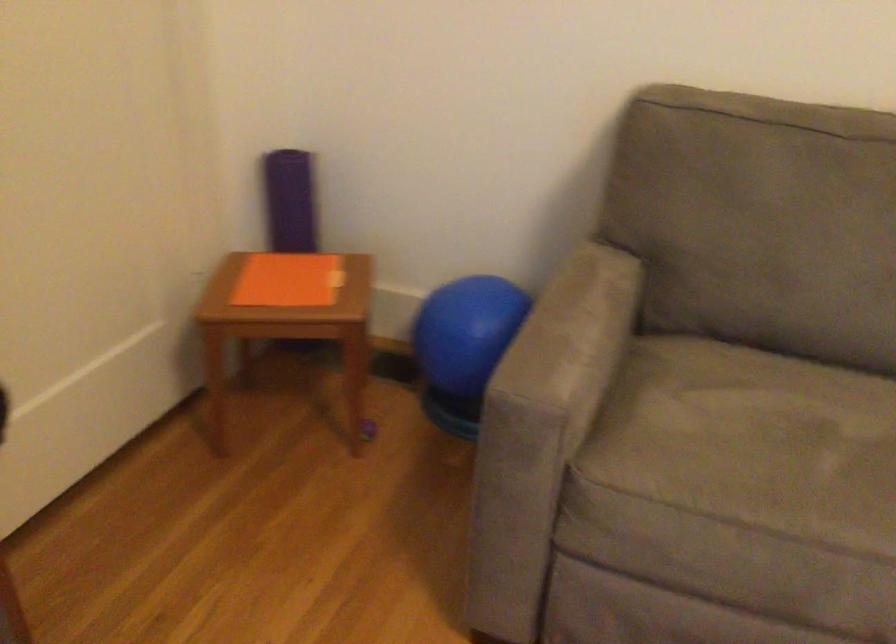
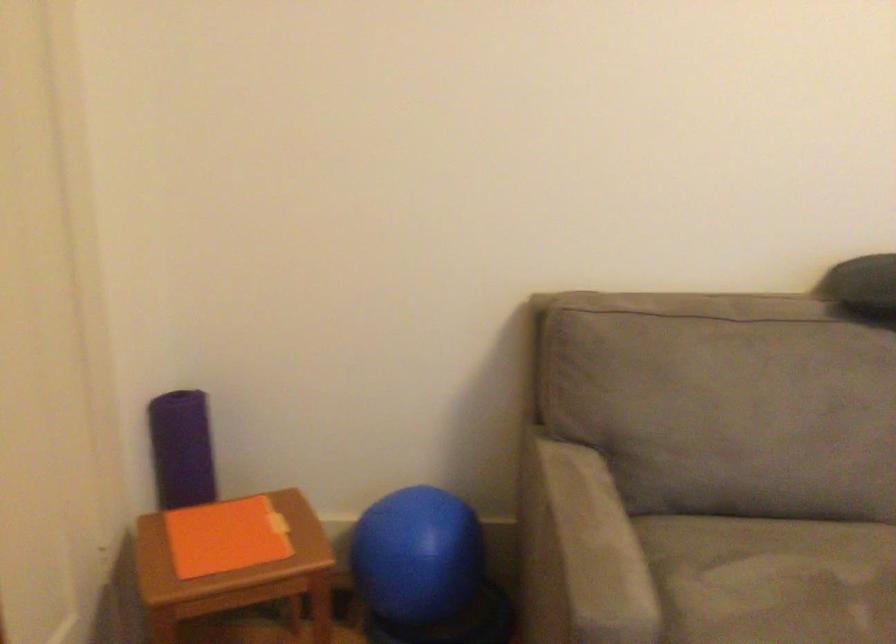
Question: How did the camera likely rotate?

Choices:
 (A) Left
 (B) Right
 (C) Up
 (D) Down

Answer: (B)